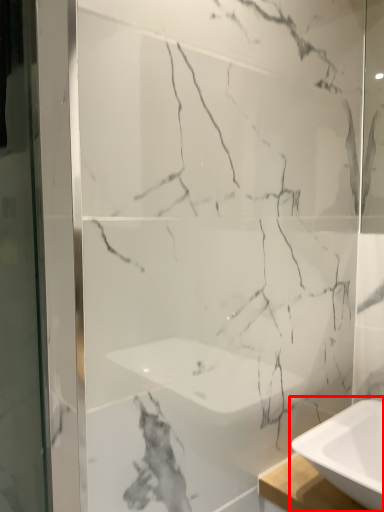
Question: In this image, where is sink (annotated by the red box) located relative to screen door?

Choices:
 (A) left
 (B) right

Answer: (B)